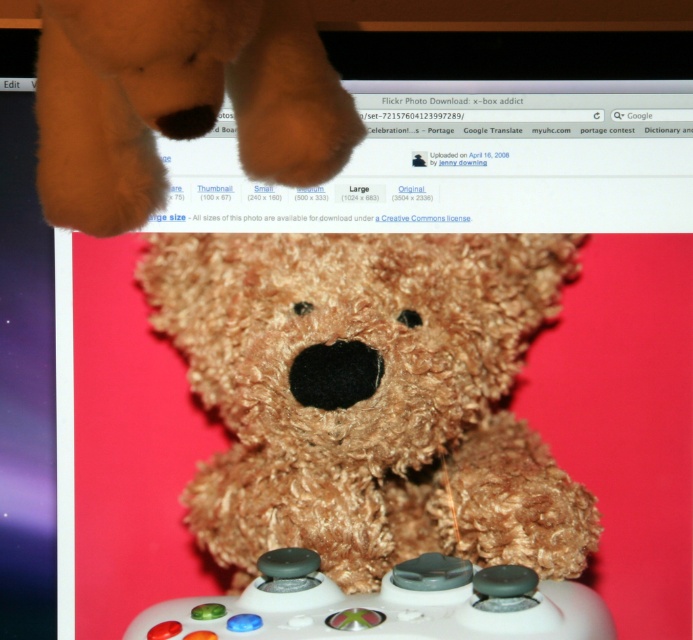
Is fuzzy brown teddy bear at upper left smaller than white matte game controller at center?

Actually, fuzzy brown teddy bear at upper left might be larger than white matte game controller at center.

Between fuzzy brown teddy bear at upper left and white matte game controller at center, which one has less height?

Standing shorter between the two is white matte game controller at center.

At what (x,y) coordinates should I click in order to perform the action: click on fuzzy brown teddy bear at upper left. Please return your answer as a coordinate pair (x, y). Image resolution: width=693 pixels, height=640 pixels. Looking at the image, I should click on (177, 99).

Which of these two, fuzzy brown teddy bear at center or fuzzy brown teddy bear at upper left, stands shorter?

fuzzy brown teddy bear at upper left

Is fuzzy brown teddy bear at center closer to camera compared to fuzzy brown teddy bear at upper left?

No, it is not.

Is point (410, 380) in front of point (170, 129)?

That is False.

Identify the location of fuzzy brown teddy bear at center. This screenshot has height=640, width=693. (369, 396).

Which is behind, point (403, 292) or point (453, 611)?

The point (403, 292) is behind.

Image resolution: width=693 pixels, height=640 pixels. I want to click on fuzzy brown teddy bear at center, so click(x=369, y=396).

Between point (403, 358) and point (595, 632), which one is positioned in front?

Point (595, 632)

This screenshot has height=640, width=693. Find the location of `fuzzy brown teddy bear at center`. fuzzy brown teddy bear at center is located at coordinates (369, 396).